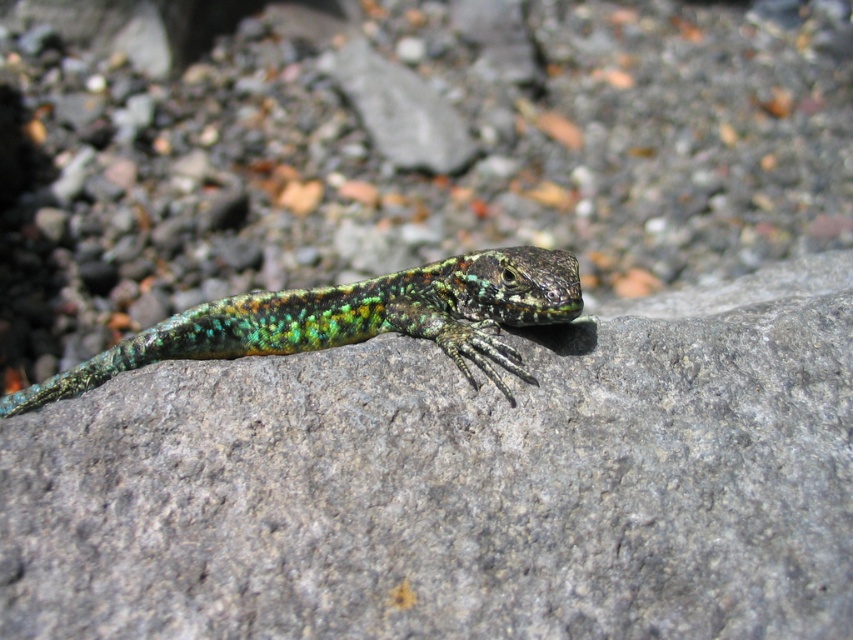
You are a photographer trying to capture the lizard on the rock. You notice two points marked on your screen at coordinates point [828,436] and point [506,321]. To ensure the lizard stays in focus, you need to know which point is closer to the camera. Which point is closer?

Point [828,436] is in front of point [506,321], so it is closer to the camera.

You are a geologist examining the image. You notice a point at coordinates (459, 483). What is located at that point?

At point (459, 483) lies green speckled rock at center.

Please provide the coordinates of the green speckled rock at center in the image. The coordinate system has the origin at the bottom left corner of the image, with the x and y axes increasing to the right and upward respectively.

The green speckled rock at center is located at coordinates approximately 0.756 on the x axis and 0.539 on the y axis.